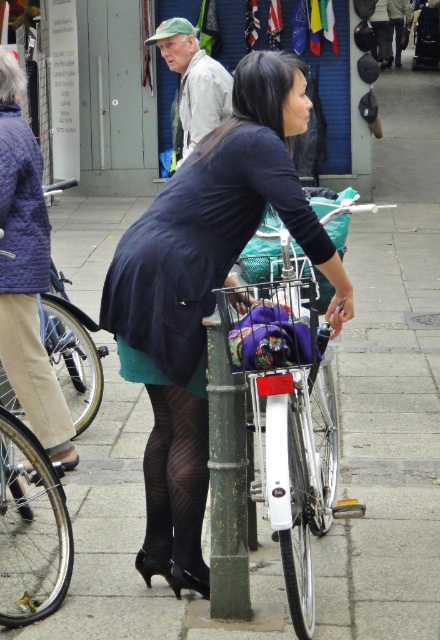
Where is the matte black dress at center located in the image?

A: The matte black dress at center is located at the 2D coordinates point (205, 292).

You are a fashion designer observing the street scene. You notice the black mesh tights at lower center and the light beige fabric pants at lower left. Which clothing item is narrower in width?

The black mesh tights at lower center are narrower in width compared to the light beige fabric pants at lower left since the black mesh tights at lower center has a smaller width according to the description.

You are a photographer setting up a shoot in this street scene. You need to ensure that the matte black dress at center and the green metallic pole at center are both visible in the frame. Given their sizes, which object should you focus on to ensure both are captured clearly?

The matte black dress at center is larger in size than the green metallic pole at center. To ensure both are visible, focus on the larger object, the matte black dress at center, as it requires more space in the frame.